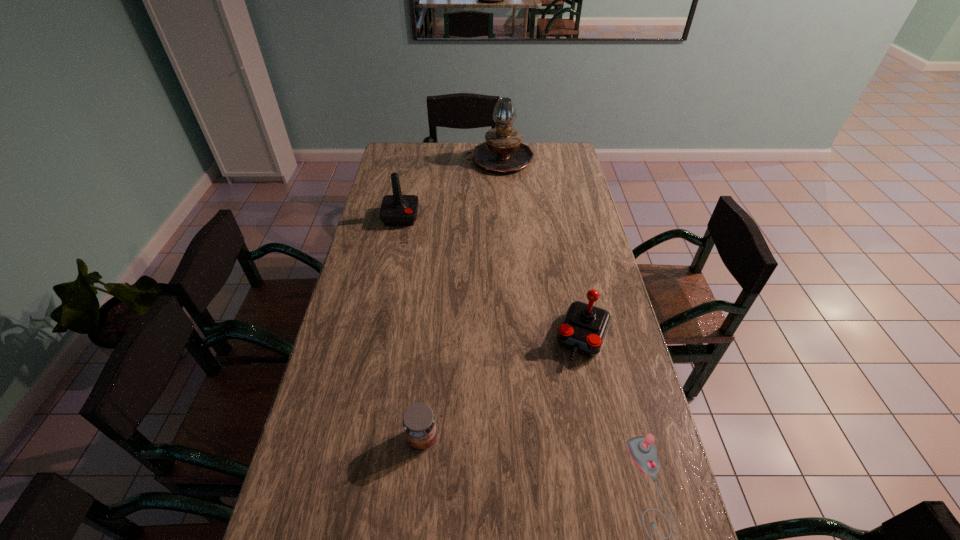
Find the location of a particular element. This screenshot has height=540, width=960. vacant space that is in between the farthest object and the fourth nearest object is located at coordinates (450, 188).

At what (x,y) coordinates should I click in order to perform the action: click on free spot between the oil lamp and the second farthest joystick. Please return your answer as a coordinate pair (x, y). Image resolution: width=960 pixels, height=540 pixels. Looking at the image, I should click on click(541, 248).

Locate an element on the screen. This screenshot has height=540, width=960. free space between the jam and the third farthest object is located at coordinates (503, 388).

Locate an element on the screen. free space between the tallest object and the third nearest object is located at coordinates (541, 248).

At what (x,y) coordinates should I click in order to perform the action: click on free spot between the second farthest joystick and the leftmost joystick. Please return your answer as a coordinate pair (x, y). The width and height of the screenshot is (960, 540). Looking at the image, I should click on (492, 277).

Where is `vacant area between the leftmost object and the third nearest object`? The height and width of the screenshot is (540, 960). vacant area between the leftmost object and the third nearest object is located at coordinates (492, 277).

This screenshot has height=540, width=960. What are the coordinates of `free space between the tallest object and the leftmost object` in the screenshot? It's located at (450, 188).

Identify the location of object that can be found as the closest to the second nearest joystick. (642, 450).

Identify which object is located as the third nearest to the jam. Please provide its 2D coordinates. Your answer should be formatted as a tuple, i.e. [(x, y)], where the tuple contains the x and y coordinates of a point satisfying the conditions above.

[(396, 210)]

Point out which joystick is positioned as the second nearest to the oil lamp. Please provide its 2D coordinates. Your answer should be formatted as a tuple, i.e. [(x, y)], where the tuple contains the x and y coordinates of a point satisfying the conditions above.

[(584, 327)]